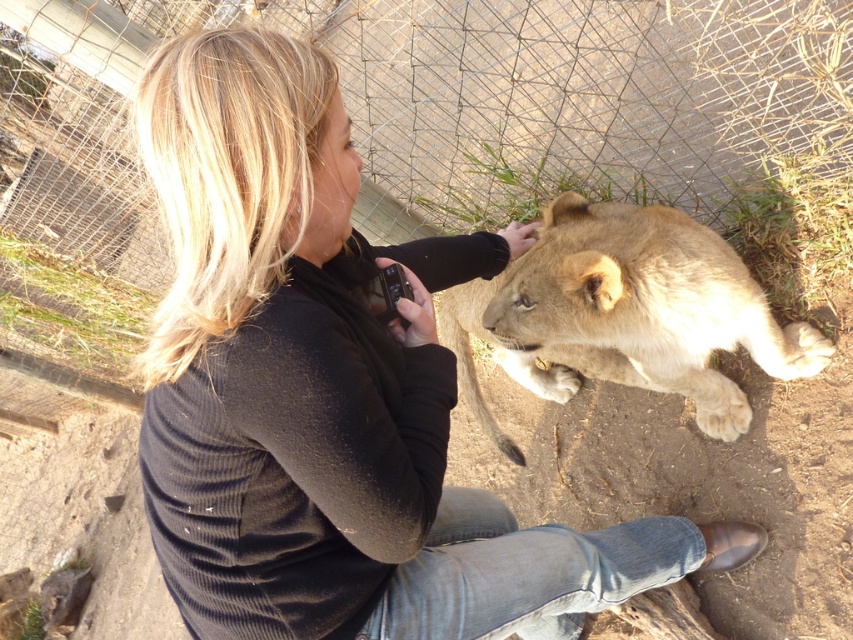
Is dark gray sweater at center taller than light brown fur at center?

Indeed, dark gray sweater at center has a greater height compared to light brown fur at center.

Which is in front, point (285, 269) or point (700, 412)?

Positioned in front is point (285, 269).

Who is more distant from viewer, (599, 554) or (540, 356)?

Point (540, 356)

Where is `dark gray sweater at center`? This screenshot has height=640, width=853. dark gray sweater at center is located at coordinates (332, 390).

Which of these two, dark gray sweater at center or metal mesh fence at upper center, stands taller?

metal mesh fence at upper center

Consider the image. Does dark gray sweater at center have a greater width compared to metal mesh fence at upper center?

No, dark gray sweater at center is not wider than metal mesh fence at upper center.

Is point (670, 518) positioned behind point (109, 42)?

Yes, point (670, 518) is behind point (109, 42).

At what (x,y) coordinates should I click in order to perform the action: click on dark gray sweater at center. Please return your answer as a coordinate pair (x, y). This screenshot has width=853, height=640. Looking at the image, I should click on (332, 390).

Does metal mesh fence at upper center have a smaller size compared to light brown fur at center?

Actually, metal mesh fence at upper center might be larger than light brown fur at center.

Where is `metal mesh fence at upper center`? The height and width of the screenshot is (640, 853). metal mesh fence at upper center is located at coordinates (527, 86).